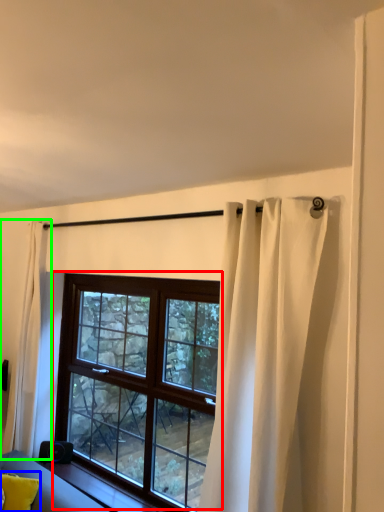
Question: Based on their relative distances, which object is nearer to window (highlighted by a red box)? Choose from pillow (highlighted by a blue box) and curtain (highlighted by a green box).

Choices:
 (A) pillow
 (B) curtain

Answer: (B)